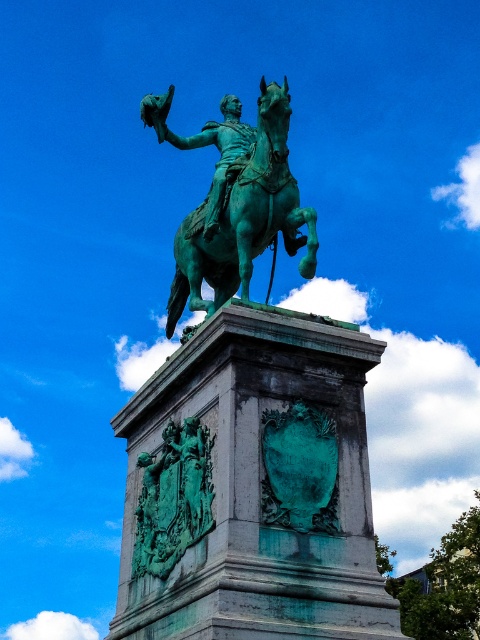
Question: Which object appears closest to the camera in this image?

Choices:
 (A) green patina statue at center
 (B) green patina shield at center
 (C) green patina horse at center

Answer: (A)

Question: Which point is farther to the camera?

Choices:
 (A) (217, 280)
 (B) (277, 141)
 (C) (216, 140)

Answer: (C)

Question: Among these objects, which one is nearest to the camera?

Choices:
 (A) green patina shield at center
 (B) green patina statue at upper center
 (C) green patina statue at center

Answer: (C)

Question: Can you confirm if green patina horse at center is thinner than green patina statue at upper center?

Choices:
 (A) yes
 (B) no

Answer: (B)

Question: Does green patina horse at center appear over green patina statue at upper center?

Choices:
 (A) no
 (B) yes

Answer: (A)

Question: Can you confirm if green patina statue at center is bigger than green patina horse at center?

Choices:
 (A) no
 (B) yes

Answer: (A)